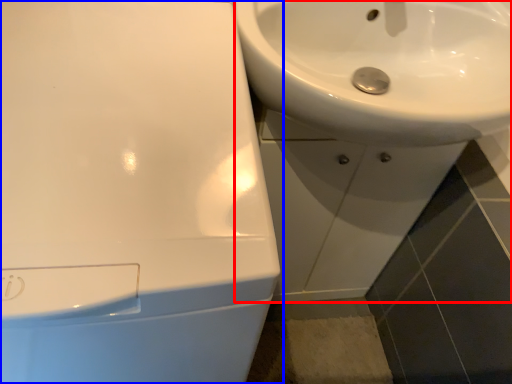
Question: Which point is closer to the camera, sink (highlighted by a red box) or sink (highlighted by a blue box)?

Choices:
 (A) sink
 (B) sink

Answer: (B)